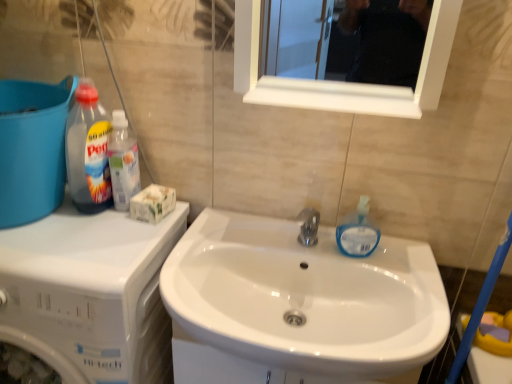
Question: Does translucent blue liquid soap at sink right, acting as the 3th cleaning product starting from the left, have a smaller size compared to blue plastic bucket at left?

Choices:
 (A) no
 (B) yes

Answer: (B)

Question: Does translucent blue liquid soap at sink right, acting as the 3th cleaning product starting from the left, appear on the left side of blue plastic bucket at left?

Choices:
 (A) yes
 (B) no

Answer: (B)

Question: From the image's perspective, is translucent blue liquid soap at sink right, acting as the 3th cleaning product starting from the left, under blue plastic bucket at left?

Choices:
 (A) no
 (B) yes

Answer: (B)

Question: Is translucent blue liquid soap at sink right, the 1th cleaning product positioned from the right, facing towards blue plastic bucket at left?

Choices:
 (A) no
 (B) yes

Answer: (A)

Question: Does translucent blue liquid soap at sink right, acting as the 3th cleaning product starting from the left, have a greater height compared to blue plastic bucket at left?

Choices:
 (A) no
 (B) yes

Answer: (A)

Question: Considering the positions of point (39, 168) and point (301, 296), is point (39, 168) closer or farther from the camera than point (301, 296)?

Choices:
 (A) closer
 (B) farther

Answer: (A)

Question: In terms of width, does blue plastic bucket at left look wider or thinner when compared to white glossy sink at center?

Choices:
 (A) thin
 (B) wide

Answer: (A)

Question: Considering the relative positions of blue plastic bucket at left and white glossy sink at center in the image provided, is blue plastic bucket at left to the left or to the right of white glossy sink at center?

Choices:
 (A) right
 (B) left

Answer: (B)

Question: Based on their sizes in the image, would you say blue plastic bucket at left is bigger or smaller than white glossy sink at center?

Choices:
 (A) big
 (B) small

Answer: (B)

Question: Is white glossy sink at center taller or shorter than translucent blue liquid soap at sink right, acting as the 3th cleaning product starting from the left?

Choices:
 (A) short
 (B) tall

Answer: (B)

Question: From the image's perspective, is white glossy sink at center above or below translucent blue liquid soap at sink right, acting as the 3th cleaning product starting from the left?

Choices:
 (A) below
 (B) above

Answer: (A)

Question: Considering the relative positions of white glossy sink at center and translucent blue liquid soap at sink right, acting as the 3th cleaning product starting from the left, in the image provided, is white glossy sink at center to the left or to the right of translucent blue liquid soap at sink right, acting as the 3th cleaning product starting from the left,?

Choices:
 (A) right
 (B) left

Answer: (B)

Question: In terms of size, does white glossy sink at center appear bigger or smaller than translucent blue liquid soap at sink right, acting as the 3th cleaning product starting from the left?

Choices:
 (A) small
 (B) big

Answer: (B)

Question: In terms of height, does transparent plastic bottle at left, acting as the third cleaning product starting from the right, look taller or shorter compared to translucent plastic bottle at upper left, the second cleaning product positioned from the right?

Choices:
 (A) tall
 (B) short

Answer: (A)

Question: Based on their positions, is transparent plastic bottle at left, which ranks as the 1th cleaning product in left-to-right order, located to the left or right of translucent plastic bottle at upper left, the second cleaning product positioned from the right?

Choices:
 (A) left
 (B) right

Answer: (A)